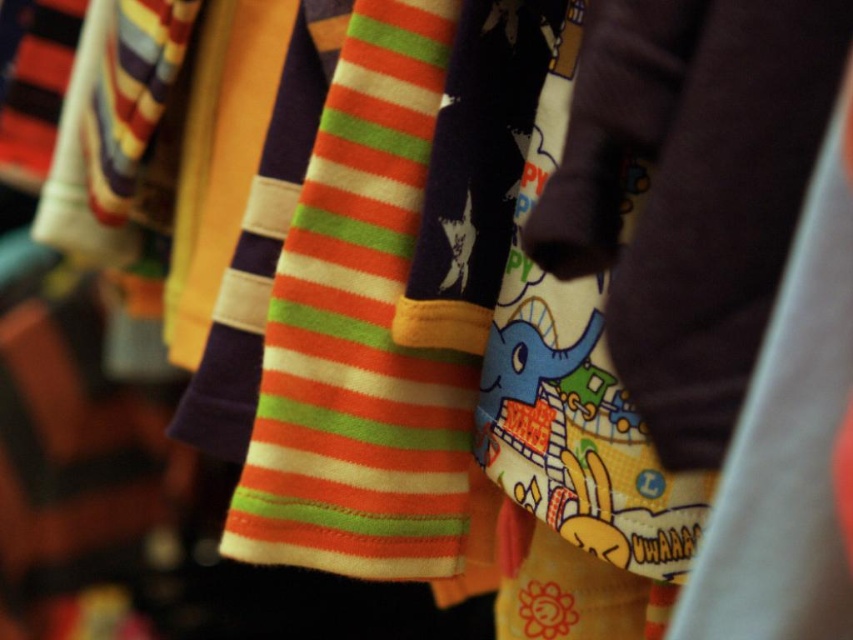
Question: Which of the following is the closest to the observer?

Choices:
 (A) matte purple tie at center
 (B) orange striped fabric at center

Answer: (A)

Question: Is matte purple tie at center smaller than orange striped fabric at center?

Choices:
 (A) no
 (B) yes

Answer: (B)

Question: Can you confirm if matte purple tie at center is positioned below orange striped fabric at center?

Choices:
 (A) no
 (B) yes

Answer: (B)

Question: Is matte purple tie at center thinner than orange striped fabric at center?

Choices:
 (A) no
 (B) yes

Answer: (B)

Question: Which of the following is the closest to the observer?

Choices:
 (A) matte purple tie at center
 (B) orange striped fabric at center

Answer: (A)

Question: Which of the following is the farthest from the observer?

Choices:
 (A) orange striped fabric at center
 (B) matte purple tie at center

Answer: (A)